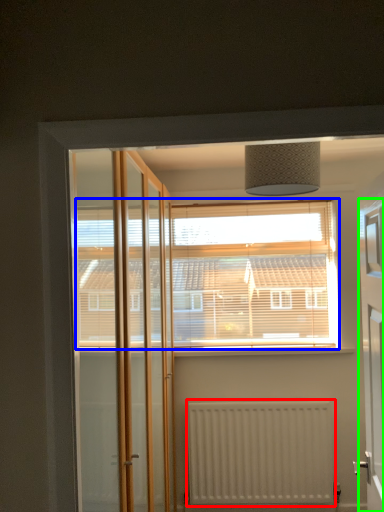
Question: Which is farther away from radiator (highlighted by a red box)? window (highlighted by a blue box) or elevator (highlighted by a green box)?

Choices:
 (A) window
 (B) elevator

Answer: (B)